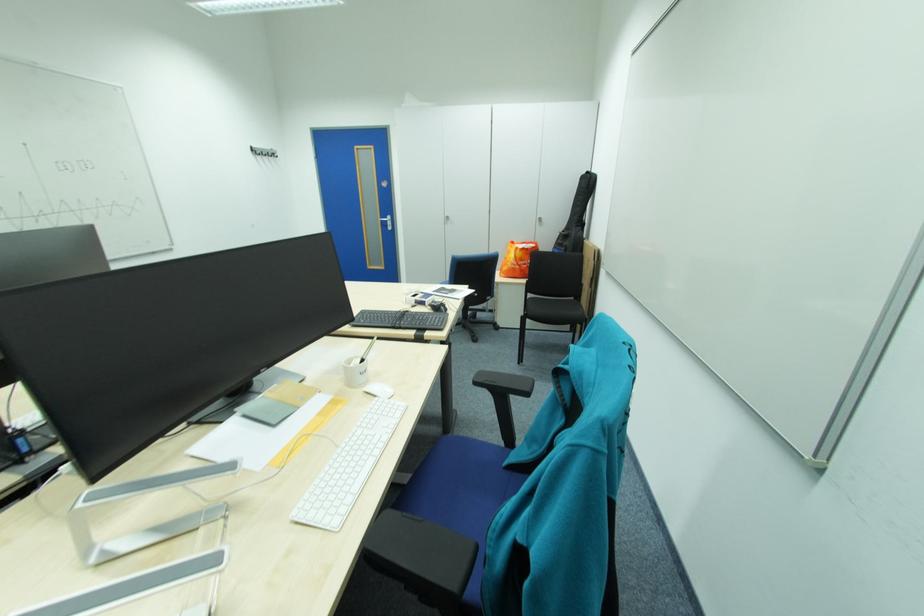
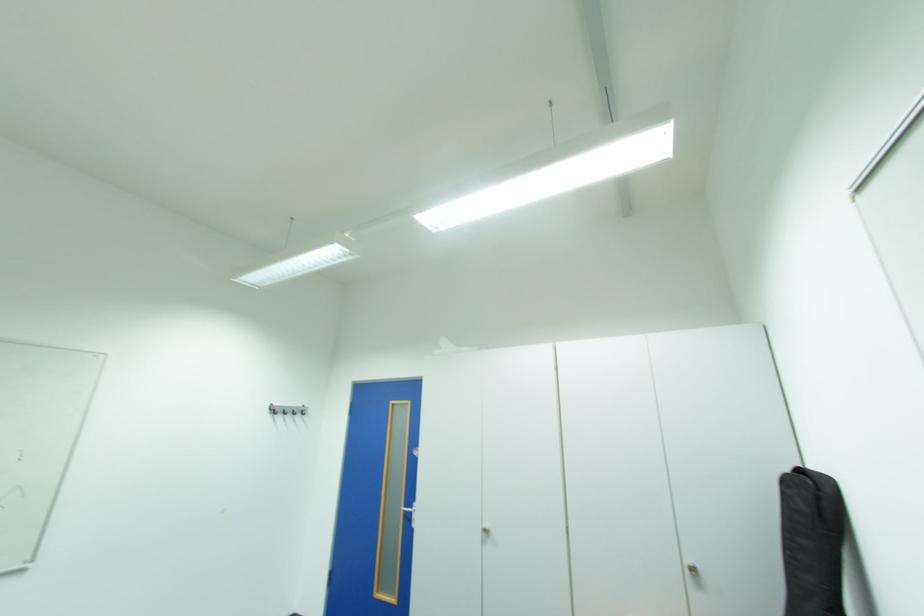
The point at (262, 153) is marked in the first image. Where is the corresponding point in the second image?

(280, 411)